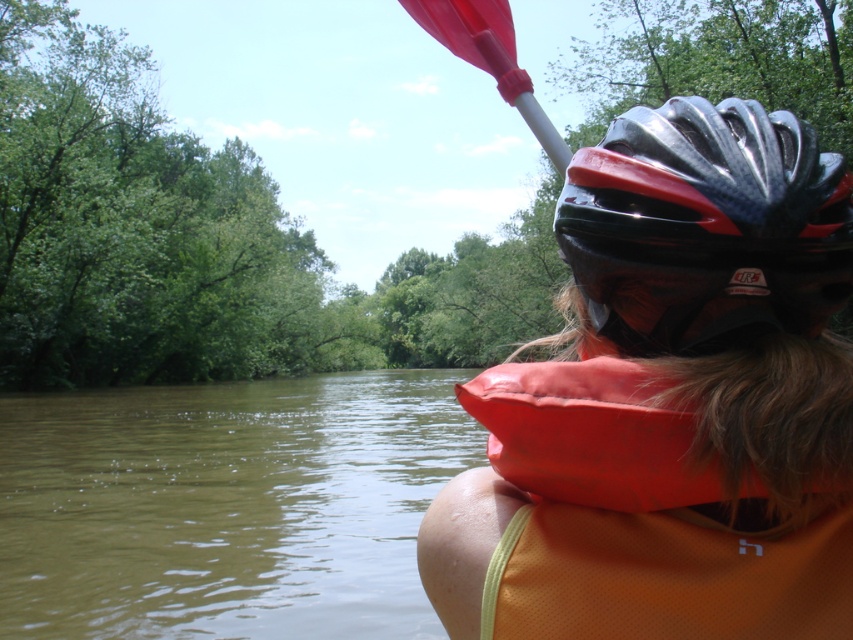
You are a safety inspector checking the distance between the orange fabric life jacket at lower right and the rubber paddle at upper center in the kayak scene. The safety regulation requires that the life jacket must be within 40 inches of the paddle for quick access. Is the current placement compliant with the regulation?

The orange fabric life jacket at lower right is 39.01 inches away from the rubber paddle at upper center, which is within the 40 inches requirement. Therefore, the current placement is compliant with the safety regulation.

You are a safety inspector assessing the kayak setup. The kayak is in the river, and you need to ensure the paddle is within reach of the paddler. The paddler is in the brown murky water at lower left. Can you confirm if the rubber paddle at upper center is within a 100 feet safety distance?

The distance between the brown murky water at lower left and the rubber paddle at upper center is 70.70 feet, which is within the 100 feet safety distance. Therefore, the rubber paddle at upper center is within reach.